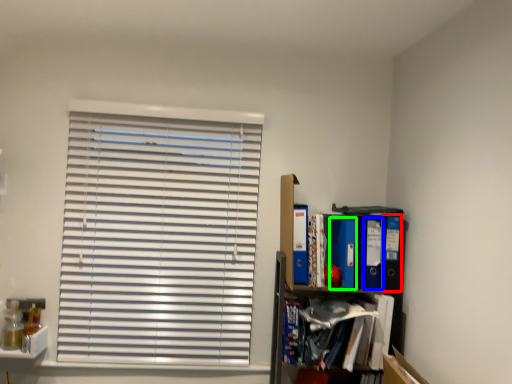
Question: Which is nearer to the paperback book (highlighted by a red box)? paperback book (highlighted by a blue box) or paperback book (highlighted by a green box).

Choices:
 (A) paperback book
 (B) paperback book

Answer: (A)